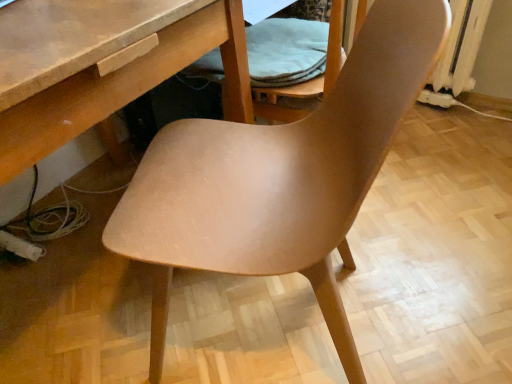
Identify the location of free point below matte wood chair at center (from a real-world perspective). (264, 325).